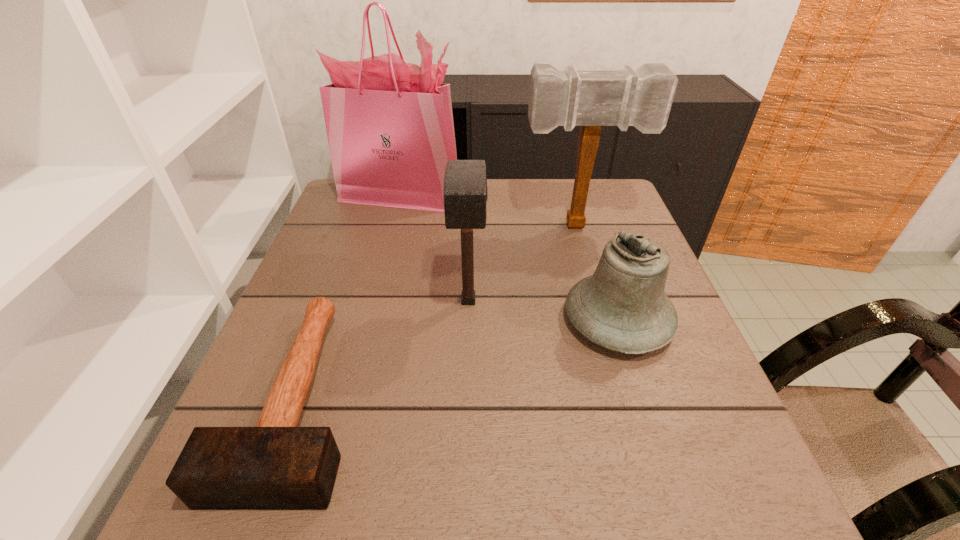
The width and height of the screenshot is (960, 540). I want to click on object that is at the far left corner, so click(390, 129).

The image size is (960, 540). Find the location of `object that is at the near left corner`. object that is at the near left corner is located at coordinates (275, 465).

The width and height of the screenshot is (960, 540). I want to click on object at the far right corner, so click(x=642, y=98).

Identify the location of free space at the far edge of the desktop. Image resolution: width=960 pixels, height=540 pixels. (520, 208).

In the image, there is a desktop. Where is `vacant space at the near edge`? The image size is (960, 540). vacant space at the near edge is located at coordinates (642, 472).

Find the location of a particular element. Image resolution: width=960 pixels, height=540 pixels. vacant region at the left edge of the desktop is located at coordinates (343, 327).

The width and height of the screenshot is (960, 540). What are the coordinates of `free space at the right edge of the desktop` in the screenshot? It's located at (684, 367).

Where is `vacant space at the far left corner`? The width and height of the screenshot is (960, 540). vacant space at the far left corner is located at coordinates (374, 213).

Locate an element on the screen. The height and width of the screenshot is (540, 960). vacant point at the far right corner is located at coordinates (593, 193).

Locate an element on the screen. The height and width of the screenshot is (540, 960). vacant space that is in between the leftmost mallet and the shopping bag is located at coordinates (349, 295).